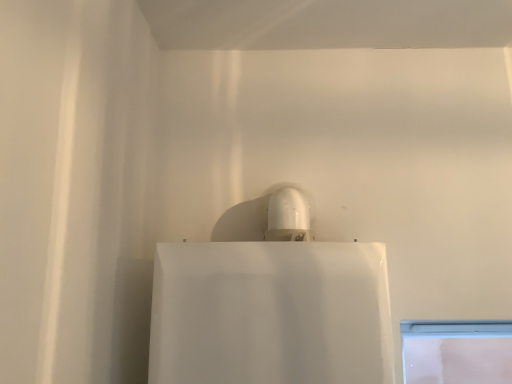
Question: Should I look upward or downward to see white glossy sink at upper center?

Choices:
 (A) up
 (B) down

Answer: (B)